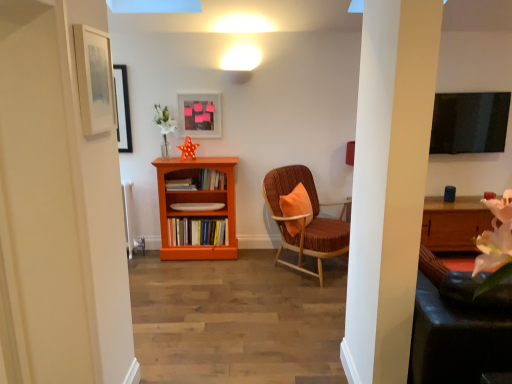
Question: Does wooden bookshelf at center, the 2th book viewed from the top, turn towards matte white picture frame at upper left, the first picture frame in the left-to-right sequence?

Choices:
 (A) no
 (B) yes

Answer: (A)

Question: Is wooden bookshelf at center, the 2th book viewed from the top, looking in the opposite direction of matte white picture frame at upper left, which is the second picture frame from back to front?

Choices:
 (A) no
 (B) yes

Answer: (A)

Question: Can you confirm if wooden bookshelf at center, which ranks as the second book in bottom-to-top order, is taller than matte white picture frame at upper left, which is the second picture frame from back to front?

Choices:
 (A) yes
 (B) no

Answer: (B)

Question: Does wooden bookshelf at center, the 2th book viewed from the top, have a lesser width compared to matte white picture frame at upper left, which is the second picture frame from back to front?

Choices:
 (A) no
 (B) yes

Answer: (A)

Question: Is wooden bookshelf at center, which ranks as the second book in bottom-to-top order, outside of matte white picture frame at upper left, the first picture frame in the left-to-right sequence?

Choices:
 (A) no
 (B) yes

Answer: (B)

Question: Considering the relative sizes of wooden bookshelf at center, which ranks as the second book in bottom-to-top order, and matte white picture frame at upper left, acting as the first picture frame starting from the front, in the image provided, is wooden bookshelf at center, which ranks as the second book in bottom-to-top order, shorter than matte white picture frame at upper left, acting as the first picture frame starting from the front,?

Choices:
 (A) yes
 (B) no

Answer: (A)

Question: From the image's perspective, is matte plastic picture frame at upper center, which appears as the 1th picture frame when viewed from the back, located beneath velvet orange swivel chair at right?

Choices:
 (A) yes
 (B) no

Answer: (B)

Question: Can velvet orange swivel chair at right be found inside matte plastic picture frame at upper center, the 1th picture frame when ordered from right to left?

Choices:
 (A) no
 (B) yes

Answer: (A)

Question: Considering the relative positions of matte plastic picture frame at upper center, which appears as the 1th picture frame when viewed from the back, and velvet orange swivel chair at right in the image provided, is matte plastic picture frame at upper center, which appears as the 1th picture frame when viewed from the back, to the left of velvet orange swivel chair at right from the viewer's perspective?

Choices:
 (A) no
 (B) yes

Answer: (B)

Question: Is matte plastic picture frame at upper center, which appears as the 1th picture frame when viewed from the back, not close to velvet orange swivel chair at right?

Choices:
 (A) yes
 (B) no

Answer: (A)

Question: Is matte plastic picture frame at upper center, which appears as the second picture frame when viewed from the left, shorter than velvet orange swivel chair at right?

Choices:
 (A) no
 (B) yes

Answer: (B)

Question: From a real-world perspective, is matte plastic picture frame at upper center, which appears as the second picture frame when viewed from the left, below velvet orange swivel chair at right?

Choices:
 (A) no
 (B) yes

Answer: (A)

Question: Is the position of orange wood bookshelf at center less distant than that of hardcover books at center, the 3th book from the top?

Choices:
 (A) yes
 (B) no

Answer: (A)